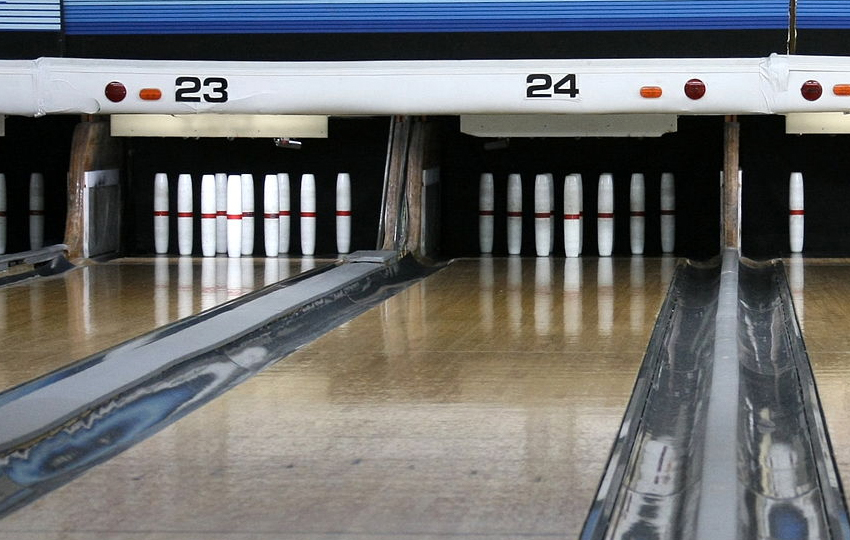
Image resolution: width=850 pixels, height=540 pixels. I want to click on orange light, so click(x=842, y=87), click(x=647, y=94), click(x=145, y=93).